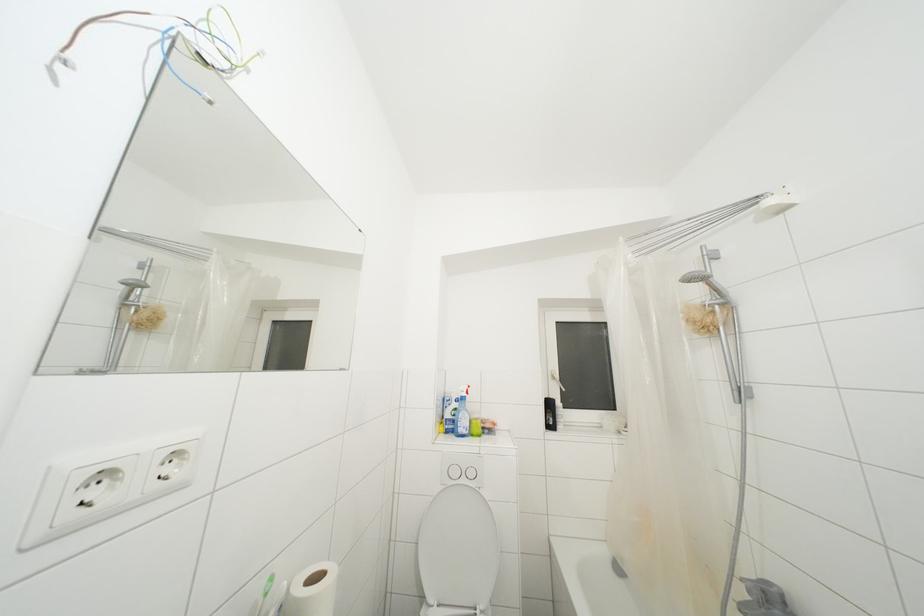
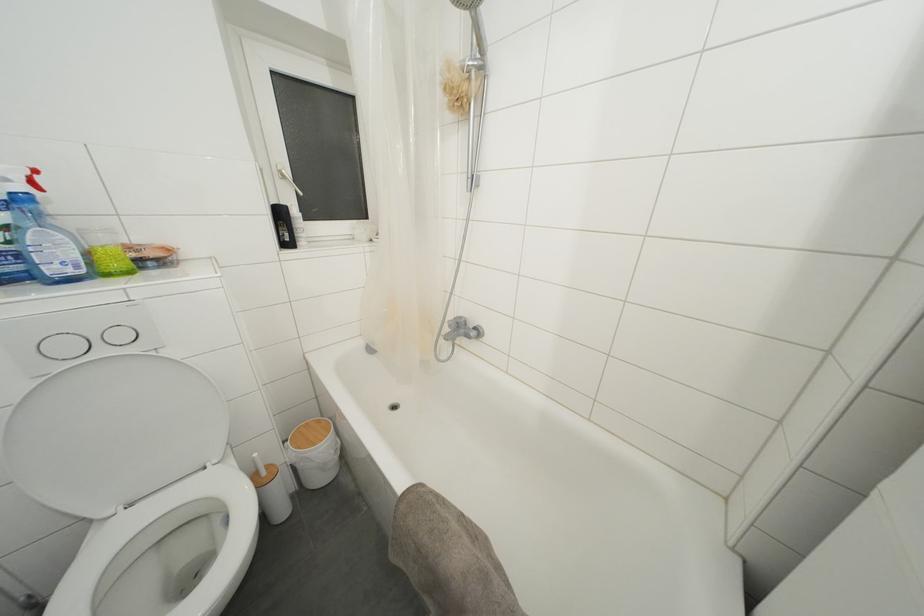
In the second image, find the point that corresponds to (470,397) in the first image.

(37, 188)